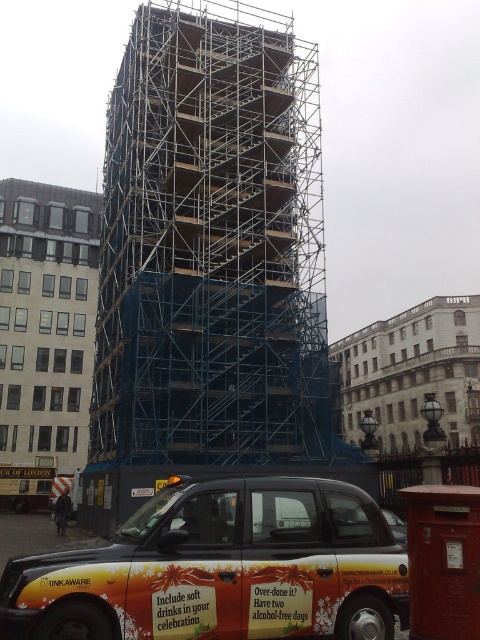
Does blue metallic scaffolding at center appear on the right side of orange painted taxi at lower center?

No, blue metallic scaffolding at center is not to the right of orange painted taxi at lower center.

Does blue metallic scaffolding at center lie behind orange painted taxi at lower center?

Yes, blue metallic scaffolding at center is further from the viewer.

What do you see at coordinates (212, 244) in the screenshot?
I see `blue metallic scaffolding at center` at bounding box center [212, 244].

You are a GUI agent. You are given a task and a screenshot of the screen. Output one action in this format:
    pyautogui.click(x=<x>, y=<y>)
    Task: Click on the blue metallic scaffolding at center
    This screenshot has height=640, width=480.
    Given the screenshot: What is the action you would take?
    pyautogui.click(x=212, y=244)